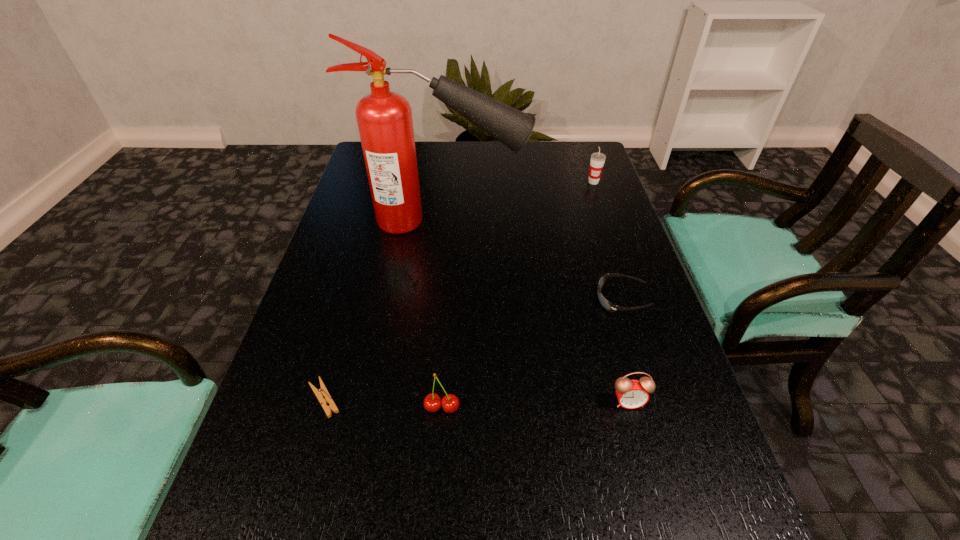
You are a GUI agent. You are given a task and a screenshot of the screen. Output one action in this format:
    pyautogui.click(x=<x>, y=<y>)
    Task: Click on the free space between the farthest object and the alarm clock
    The width and height of the screenshot is (960, 540).
    Given the screenshot: What is the action you would take?
    pyautogui.click(x=611, y=292)

The width and height of the screenshot is (960, 540). Find the location of `empty location between the fifth nearest object and the alarm clock`. empty location between the fifth nearest object and the alarm clock is located at coordinates (536, 312).

Locate an element on the screen. This screenshot has width=960, height=540. free area in between the sunglasses and the cup is located at coordinates (608, 241).

I want to click on vacant space in between the clothespin and the cherry, so click(383, 403).

Where is `free space between the clothespin and the sunglasses`? The image size is (960, 540). free space between the clothespin and the sunglasses is located at coordinates (473, 349).

Where is `blank region between the fifth tallest object and the clothespin`? blank region between the fifth tallest object and the clothespin is located at coordinates (473, 349).

I want to click on free space that is in between the cherry and the fifth tallest object, so click(x=532, y=353).

Where is `empty space that is in between the cherry and the fire extinguisher`? empty space that is in between the cherry and the fire extinguisher is located at coordinates (443, 314).

Identify which object is located as the third nearest to the alarm clock. Please provide its 2D coordinates. Your answer should be formatted as a tuple, i.e. [(x, y)], where the tuple contains the x and y coordinates of a point satisfying the conditions above.

[(384, 118)]

Identify which object is located as the third nearest to the cherry. Please provide its 2D coordinates. Your answer should be formatted as a tuple, i.e. [(x, y)], where the tuple contains the x and y coordinates of a point satisfying the conditions above.

[(606, 304)]